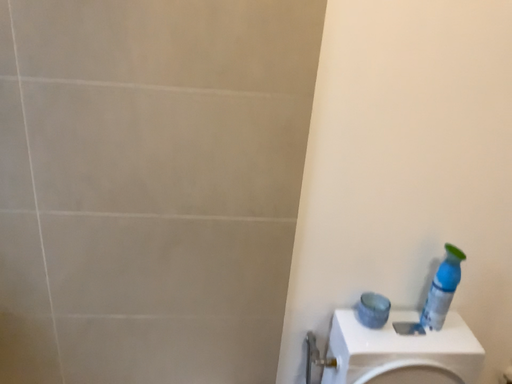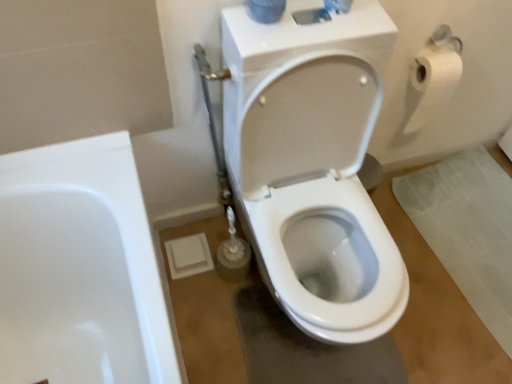
Question: Which way did the camera rotate in the video?

Choices:
 (A) rotated upward
 (B) rotated downward

Answer: (B)